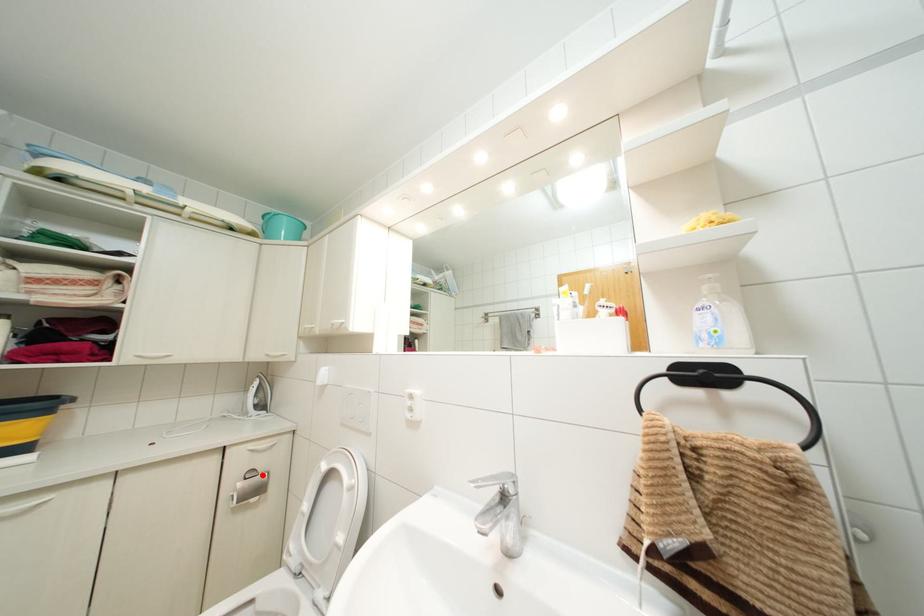
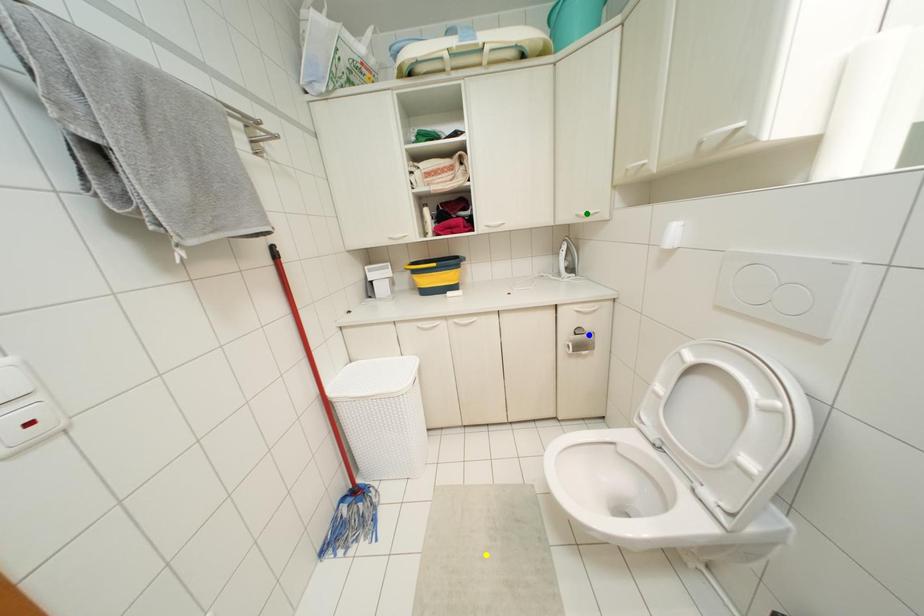
Question: I am providing you with two images of the same scene from different viewpoints. A red point is marked on the first image. You are given multiple points on the second image. Which spot in image 2 lines up with the point in image 1?

Choices:
 (A) yellow point
 (B) green point
 (C) blue point

Answer: (C)